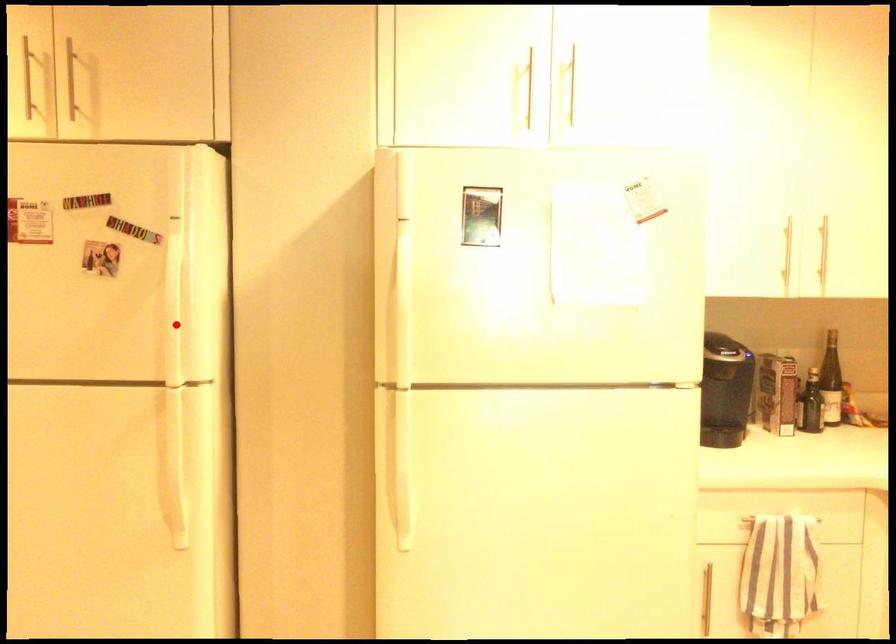
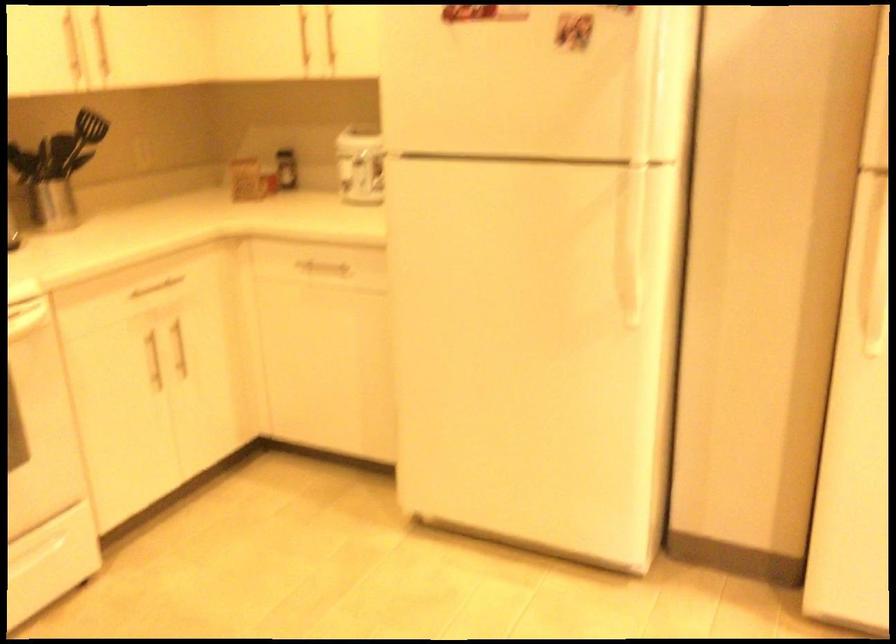
Find the pixel in the second image that matches the highlighted location in the first image.

(642, 104)